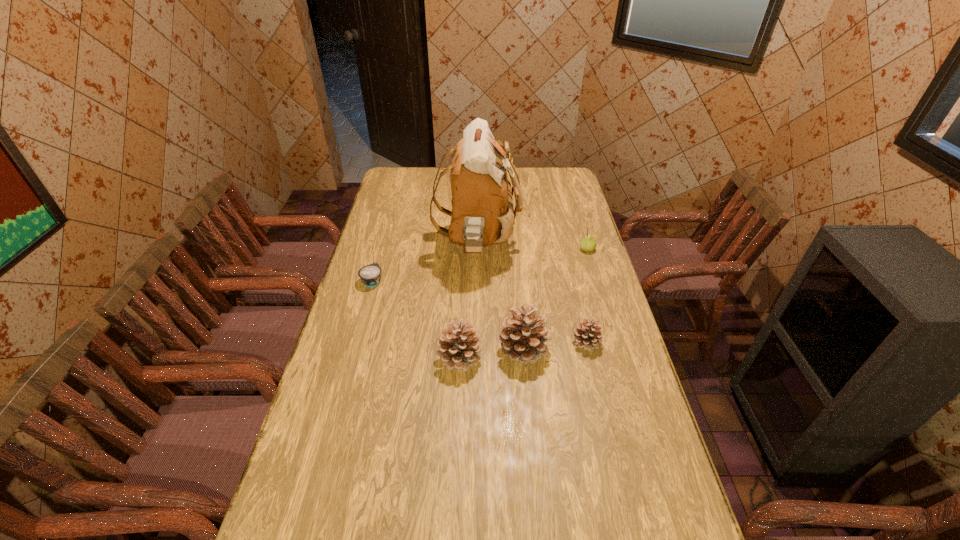
Where is `the leftmost pinecone`? This screenshot has height=540, width=960. the leftmost pinecone is located at coordinates (458, 348).

Locate an element on the screen. This screenshot has width=960, height=540. the third tallest object is located at coordinates (458, 348).

This screenshot has height=540, width=960. What are the coordinates of `the second pinecone from left to right` in the screenshot? It's located at (523, 336).

Find the location of a particular element. the shortest pinecone is located at coordinates click(587, 335).

This screenshot has height=540, width=960. In order to click on the rightmost pinecone in this screenshot , I will do `click(587, 335)`.

Locate an element on the screen. This screenshot has width=960, height=540. backpack is located at coordinates (482, 213).

At what (x,y) coordinates should I click in order to perform the action: click on pear. Please return your answer as a coordinate pair (x, y). This screenshot has height=540, width=960. Looking at the image, I should click on (588, 243).

Identify the location of the shortest object. (370, 275).

This screenshot has height=540, width=960. Identify the location of yogurt. (370, 275).

Find the location of a particular element. The image size is (960, 540). free point located on the front of the second tallest pinecone is located at coordinates (453, 502).